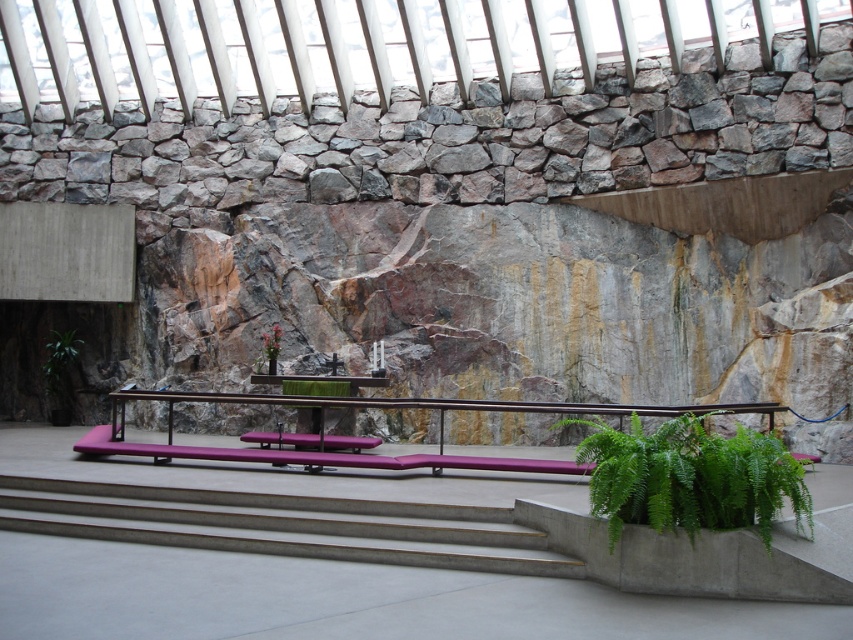
You are standing in the modern church or chapel depicted in the image. You need to locate the green leafy plant at lower right. Based on the coordinates provided, where exactly would you find it?

The green leafy plant at lower right is located at coordinates point (689,477).